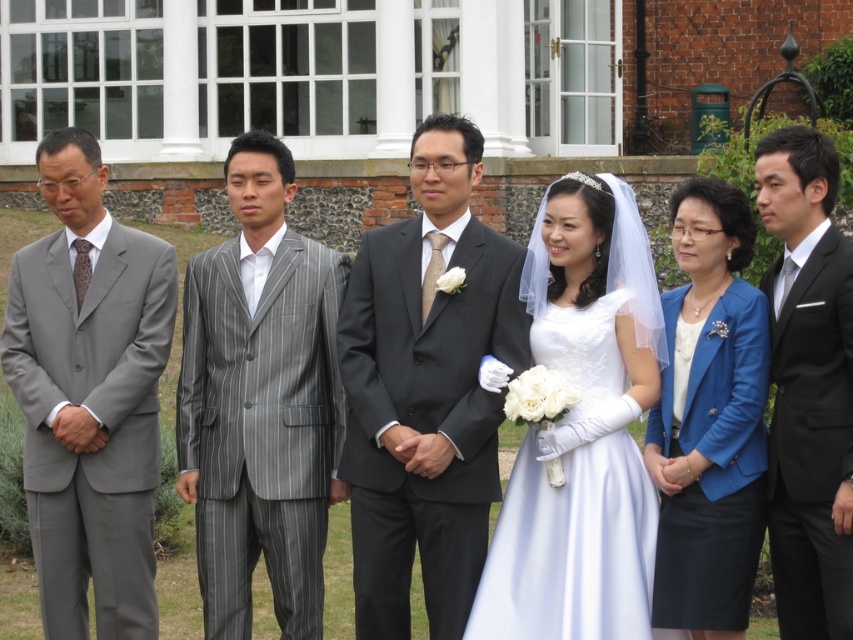
Question: Which object appears farthest from the camera in this image?

Choices:
 (A) black satin suit at right
 (B) gray pinstripe suit at center

Answer: (B)

Question: Is matte gray suit at left wider than blue satin blazer at center?

Choices:
 (A) no
 (B) yes

Answer: (B)

Question: Is gray pinstripe suit at center to the left of black satin suit at right from the viewer's perspective?

Choices:
 (A) no
 (B) yes

Answer: (B)

Question: Which of the following is the closest to the observer?

Choices:
 (A) matte black suit at center
 (B) black satin suit at right
 (C) gray pinstripe suit at center
 (D) matte gray suit at left

Answer: (B)

Question: Does blue satin blazer at center have a smaller size compared to white satin dress at center?

Choices:
 (A) no
 (B) yes

Answer: (A)

Question: Among these points, which one is farthest from the camera?

Choices:
 (A) (665, 493)
 (B) (85, 161)
 (C) (640, 552)

Answer: (B)